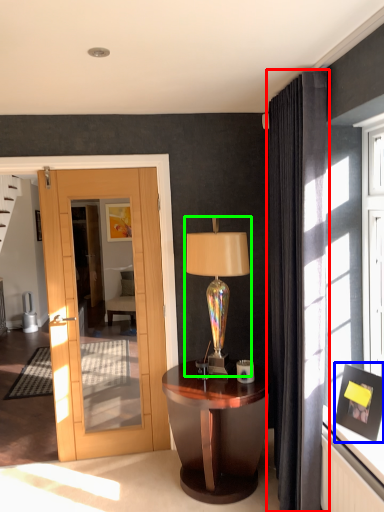
Question: Estimate the real-world distances between objects in this image. Which object is farther from curtain (highlighted by a red box), picture frame (highlighted by a blue box) or table lamp (highlighted by a green box)?

Choices:
 (A) picture frame
 (B) table lamp

Answer: (B)